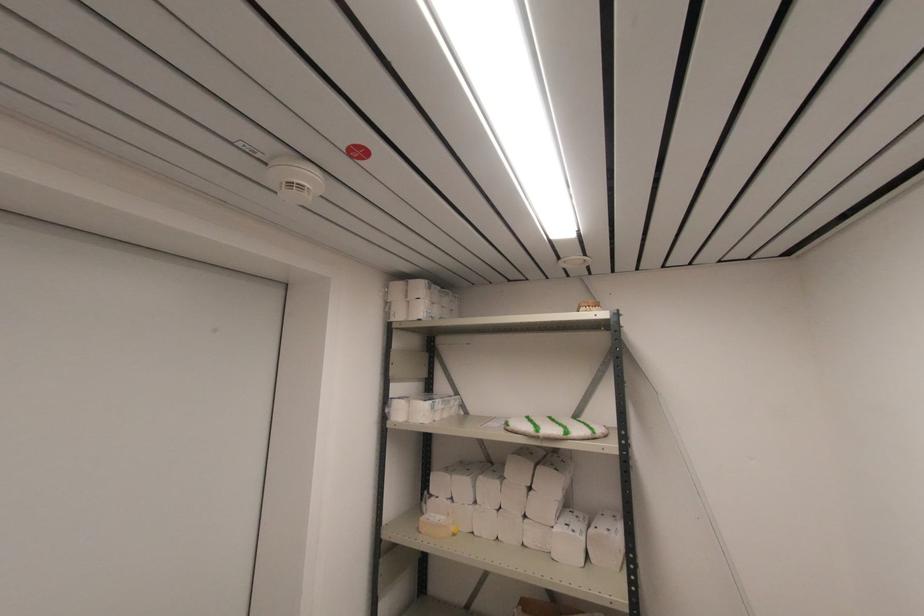
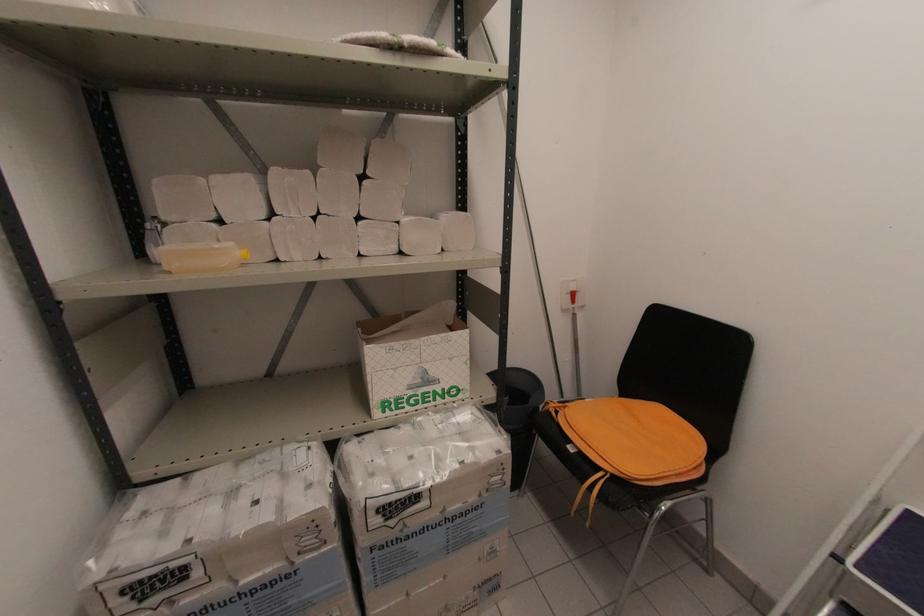
Based on the continuous images, in which direction is the camera rotating?

The camera rotated toward right-down.